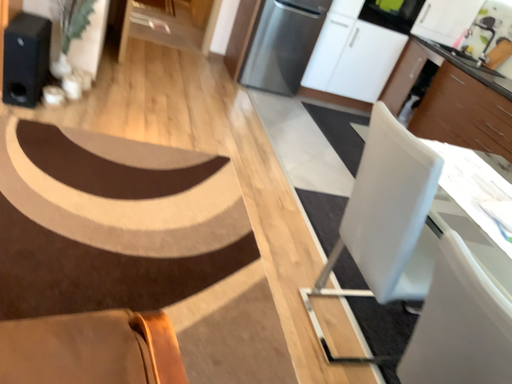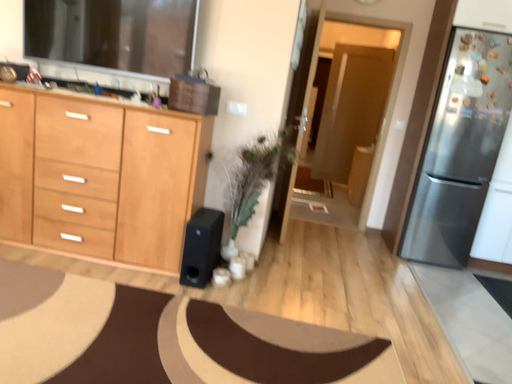
Question: How did the camera likely rotate when shooting the video?

Choices:
 (A) rotated right
 (B) rotated left

Answer: (B)